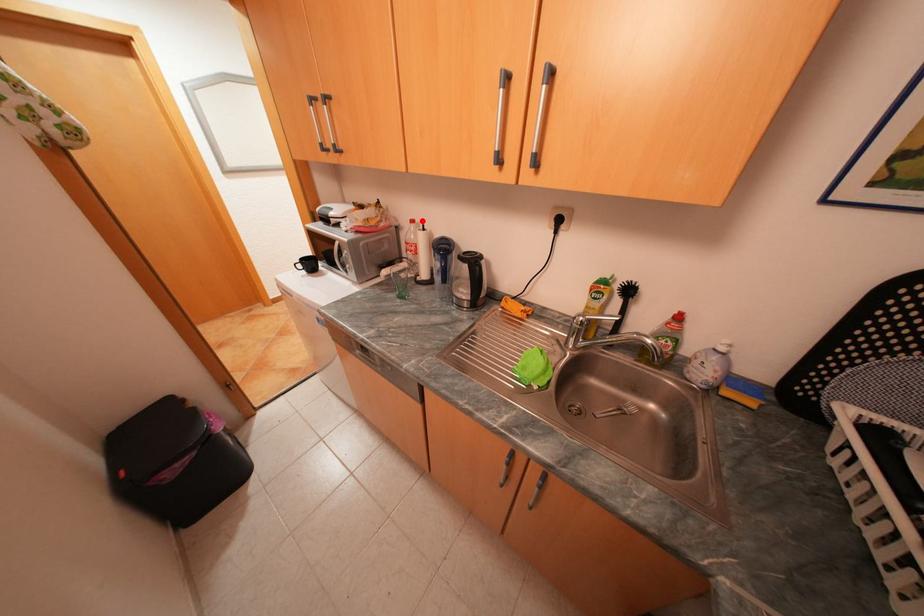
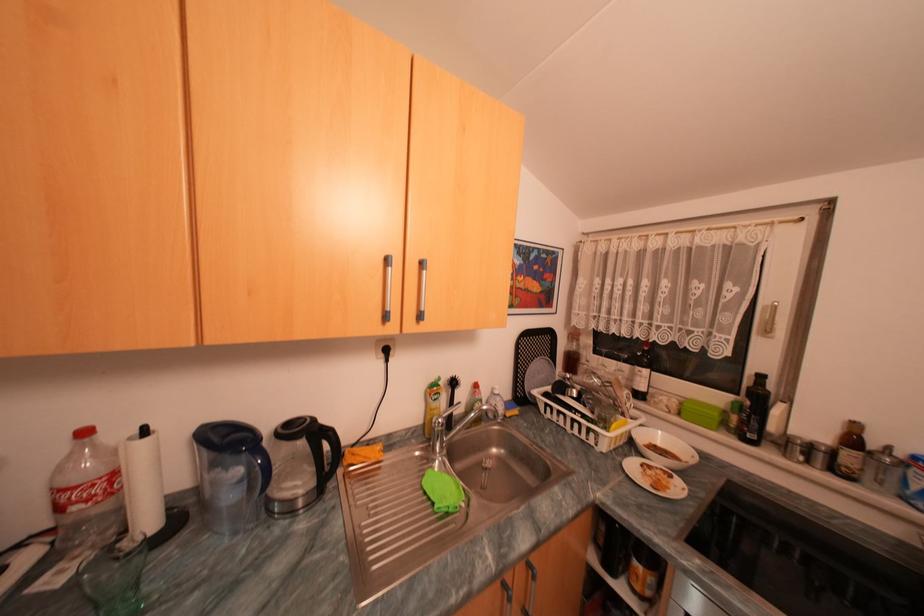
Find the pixel in the second image that matches the highlighted location in the first image.

(94, 432)